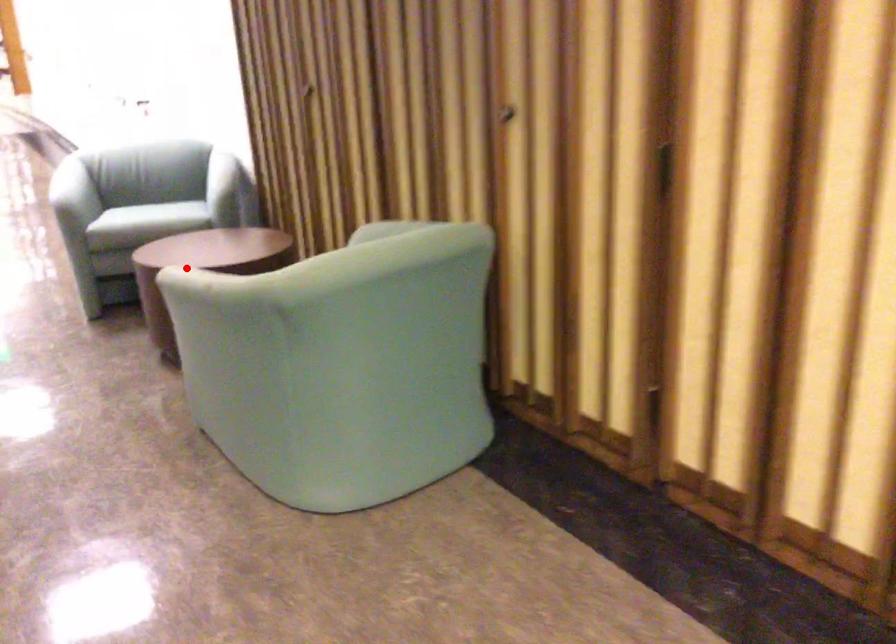
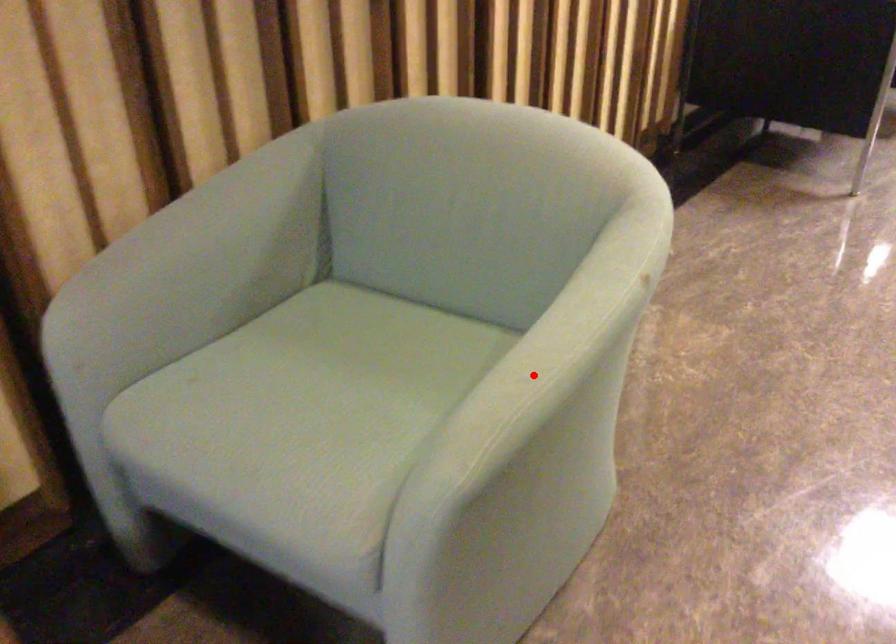
Based on the photo, I am providing you with two images of the same scene from different viewpoints. A red point is marked on the first image and another point is marked on the second image. Are the points marked in image1 and image2 representing the same 3D position?

Yes